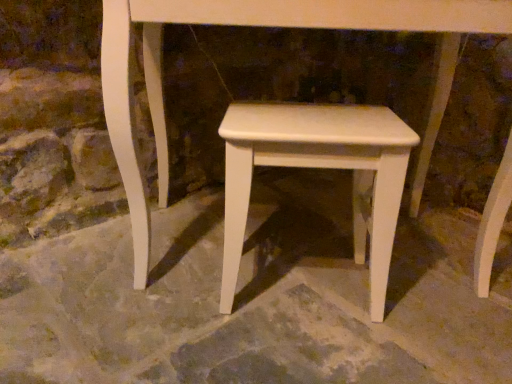
Locate an element on the screen. This screenshot has height=384, width=512. vacant area that lies in front of white matte stool at center is located at coordinates (305, 354).